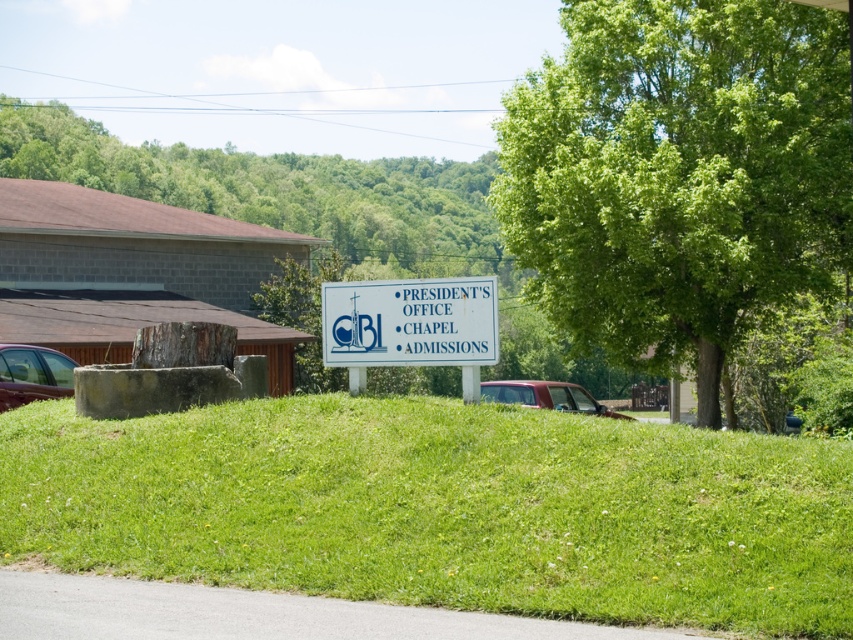
You are standing at the signboard in the center of the grassy area. You want to reach a point that is 88.13 feet away from you. Which direction should you go to reach the point at coordinates point (576, 90)?

The point at coordinates point (576, 90) is 88.13 feet away from the viewer. Since the viewer is at the signboard in the center, you should move towards the direction of the building with a reddish brown roof and gray brick facade on the left side of the frame to reach the point.

You are a visitor at the CBBI campus and want to find the signboard. You see a green leafy tree at center and a white plastic sign at center. Which object is higher up in the image?

The green leafy tree at center is located above the white plastic sign at center, so it is higher up in the image.